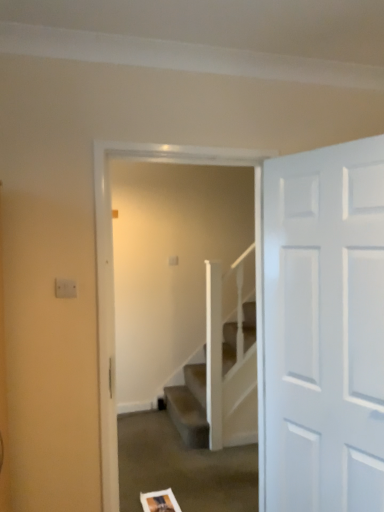
Question: Considering the positions of white painted wood door at right and carpeted stairs at center in the image, is white painted wood door at right wider or thinner than carpeted stairs at center?

Choices:
 (A) thin
 (B) wide

Answer: (A)

Question: From the image's perspective, is white painted wood door at right above or below carpeted stairs at center?

Choices:
 (A) above
 (B) below

Answer: (A)

Question: Visually, is white painted wood door at right positioned to the left or to the right of carpeted stairs at center?

Choices:
 (A) right
 (B) left

Answer: (A)

Question: Is carpeted stairs at center in front of or behind white painted wood door at right in the image?

Choices:
 (A) front
 (B) behind

Answer: (B)

Question: Is carpeted stairs at center inside or outside of white painted wood door at right?

Choices:
 (A) inside
 (B) outside

Answer: (B)

Question: Considering the positions of point (249, 153) and point (299, 410), is point (249, 153) closer or farther from the camera than point (299, 410)?

Choices:
 (A) closer
 (B) farther

Answer: (B)

Question: Looking at the image, does carpeted stairs at center seem bigger or smaller compared to white painted wood door at right?

Choices:
 (A) small
 (B) big

Answer: (B)